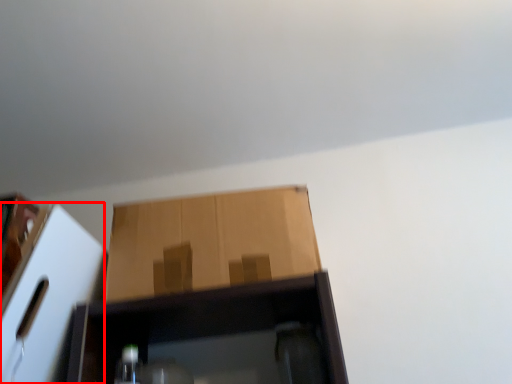
Question: Observing the image, what is the correct spatial positioning of cardboard box (annotated by the red box) in reference to cardboard box?

Choices:
 (A) left
 (B) right

Answer: (A)